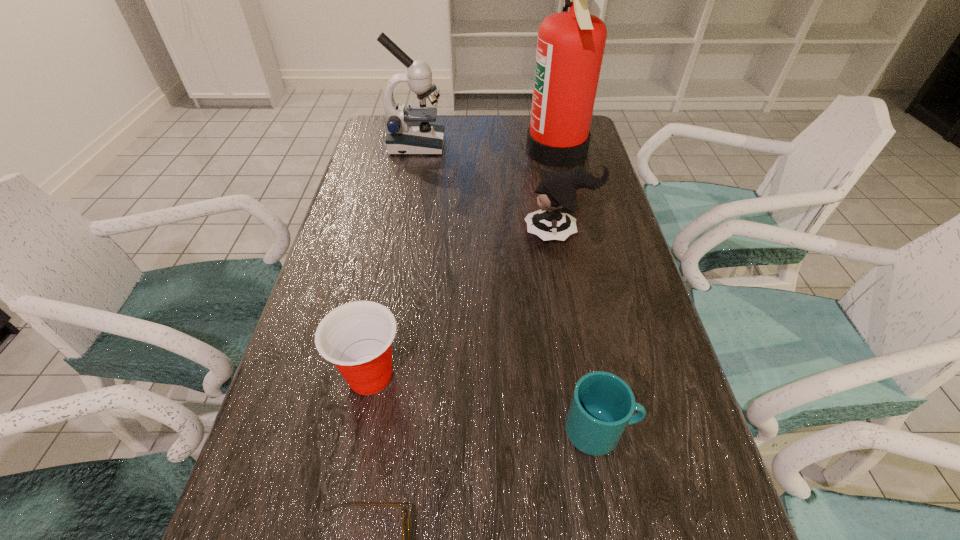
What are the coordinates of `cup that is positioned at the left edge` in the screenshot? It's located at (356, 337).

This screenshot has width=960, height=540. What are the coordinates of `fire extinguisher positioned at the right edge` in the screenshot? It's located at (570, 45).

Locate an element on the screen. The width and height of the screenshot is (960, 540). doll that is at the right edge is located at coordinates (557, 198).

The image size is (960, 540). What are the coordinates of `cup at the right edge` in the screenshot? It's located at (602, 405).

The height and width of the screenshot is (540, 960). Identify the location of object located in the far left corner section of the desktop. (409, 132).

Locate an element on the screen. object at the far right corner is located at coordinates (570, 45).

Locate an element on the screen. The width and height of the screenshot is (960, 540). free region at the far edge of the desktop is located at coordinates (482, 134).

Identify the location of vacant space at the left edge of the desktop. This screenshot has width=960, height=540. (393, 176).

In the image, there is a desktop. Where is `free space at the right edge`? free space at the right edge is located at coordinates (639, 423).

Where is `free location at the far left corner`? Image resolution: width=960 pixels, height=540 pixels. free location at the far left corner is located at coordinates (379, 114).